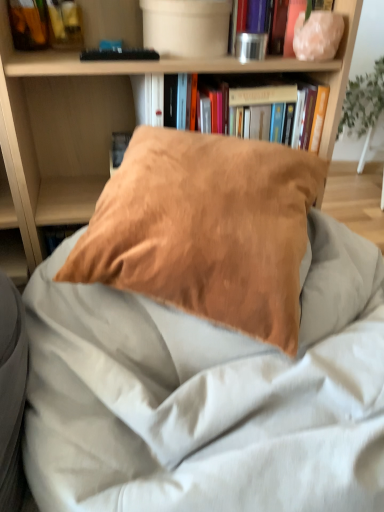
Question: Is matte brown pillow at center taller than suede-like brown pillow at center?

Choices:
 (A) no
 (B) yes

Answer: (B)

Question: Is matte brown pillow at center behind suede-like brown pillow at center?

Choices:
 (A) no
 (B) yes

Answer: (B)

Question: From the image's perspective, does matte brown pillow at center appear lower than suede-like brown pillow at center?

Choices:
 (A) no
 (B) yes

Answer: (A)

Question: From the image's perspective, would you say matte brown pillow at center is positioned over suede-like brown pillow at center?

Choices:
 (A) yes
 (B) no

Answer: (A)

Question: Is matte brown pillow at center at the left side of suede-like brown pillow at center?

Choices:
 (A) no
 (B) yes

Answer: (B)

Question: Is matte brown pillow at center wider than suede-like brown pillow at center?

Choices:
 (A) no
 (B) yes

Answer: (B)

Question: Can you confirm if suede-like brown pillow at center is positioned to the left of suede-like brown pillow at center?

Choices:
 (A) no
 (B) yes

Answer: (A)

Question: Does suede-like brown pillow at center lie in front of suede-like brown pillow at center?

Choices:
 (A) yes
 (B) no

Answer: (A)

Question: Is suede-like brown pillow at center taller than suede-like brown pillow at center?

Choices:
 (A) yes
 (B) no

Answer: (A)

Question: Is suede-like brown pillow at center shorter than suede-like brown pillow at center?

Choices:
 (A) yes
 (B) no

Answer: (B)

Question: From the image's perspective, does suede-like brown pillow at center appear higher than suede-like brown pillow at center?

Choices:
 (A) no
 (B) yes

Answer: (A)

Question: Can you see suede-like brown pillow at center touching suede-like brown pillow at center?

Choices:
 (A) yes
 (B) no

Answer: (A)

Question: From a real-world perspective, is matte brown pillow at center on top of metallic silver canister at upper center, arranged as the second book when ordered from the bottom?

Choices:
 (A) no
 (B) yes

Answer: (A)